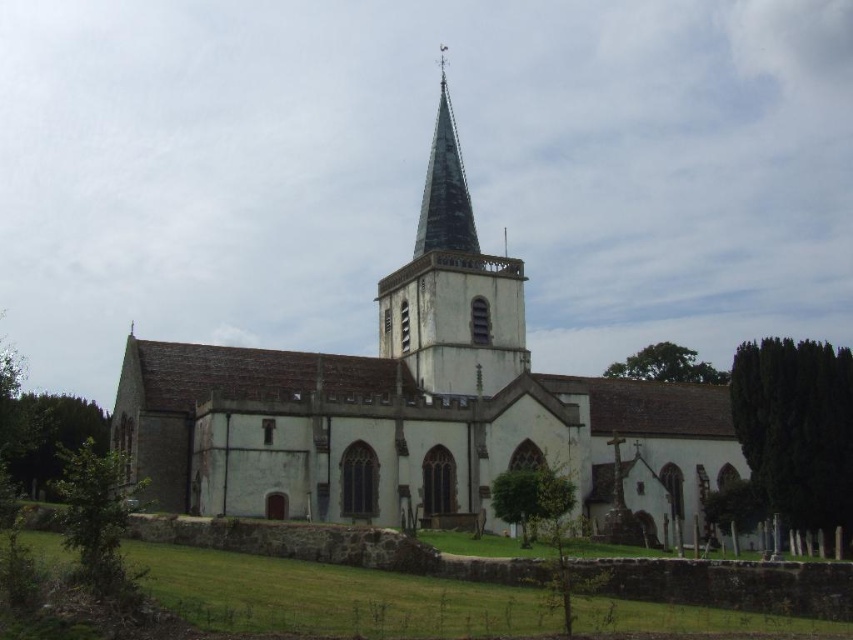
Can you confirm if white stone church at center is shorter than green copper steeple at center?

Yes.

Is white stone church at center smaller than green copper steeple at center?

Incorrect, white stone church at center is not smaller in size than green copper steeple at center.

Who is more distant from viewer, (x=689, y=518) or (x=432, y=392)?

Positioned behind is point (x=689, y=518).

At what (x,y) coordinates should I click in order to perform the action: click on white stone church at center. Please return your answer as a coordinate pair (x, y). Looking at the image, I should click on (413, 417).

Does white stone church at center have a lesser width compared to green glass spire at upper center?

Incorrect, white stone church at center's width is not less than green glass spire at upper center's.

Can you confirm if white stone church at center is shorter than green glass spire at upper center?

No, white stone church at center is not shorter than green glass spire at upper center.

Is point (473, 388) positioned behind point (457, 176)?

No, (473, 388) is closer to viewer.

I want to click on white stone church at center, so click(413, 417).

Does green copper steeple at center appear on the right side of green glass spire at upper center?

Incorrect, green copper steeple at center is not on the right side of green glass spire at upper center.

Who is higher up, green copper steeple at center or green glass spire at upper center?

green glass spire at upper center is above.

What do you see at coordinates (451, 285) in the screenshot?
I see `green copper steeple at center` at bounding box center [451, 285].

Where is `green copper steeple at center`? Image resolution: width=853 pixels, height=640 pixels. green copper steeple at center is located at coordinates (451, 285).